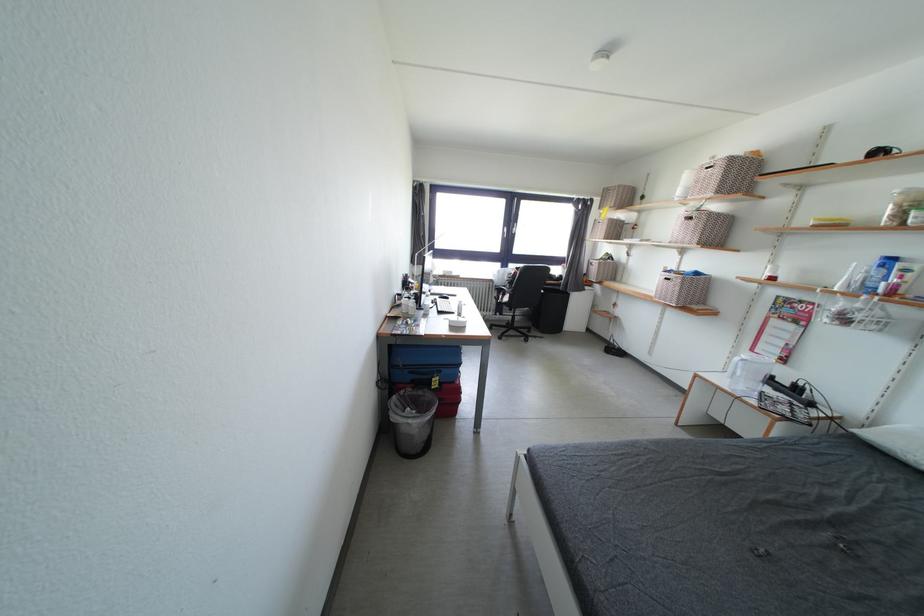
Identify the location of black sunglasses. The width and height of the screenshot is (924, 616). (881, 151).